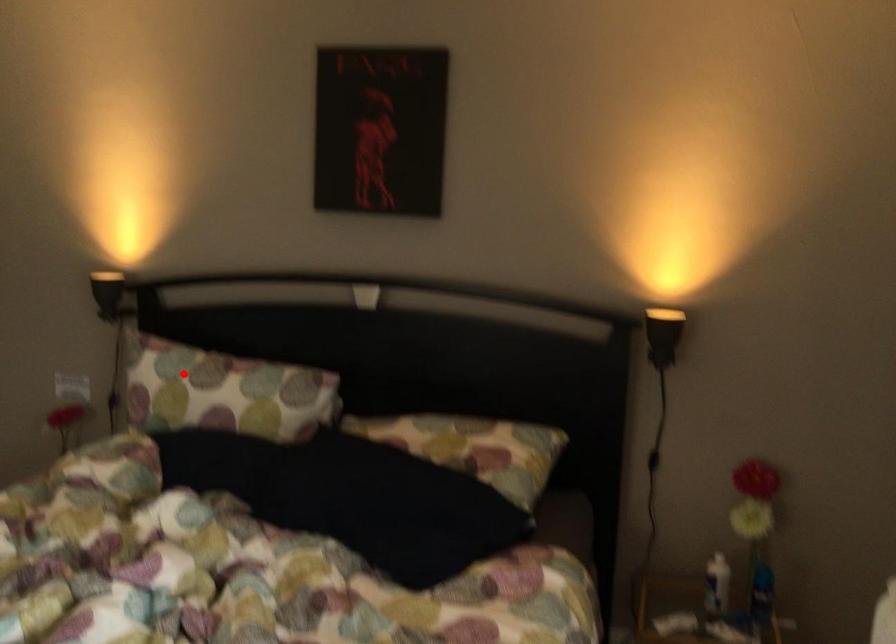
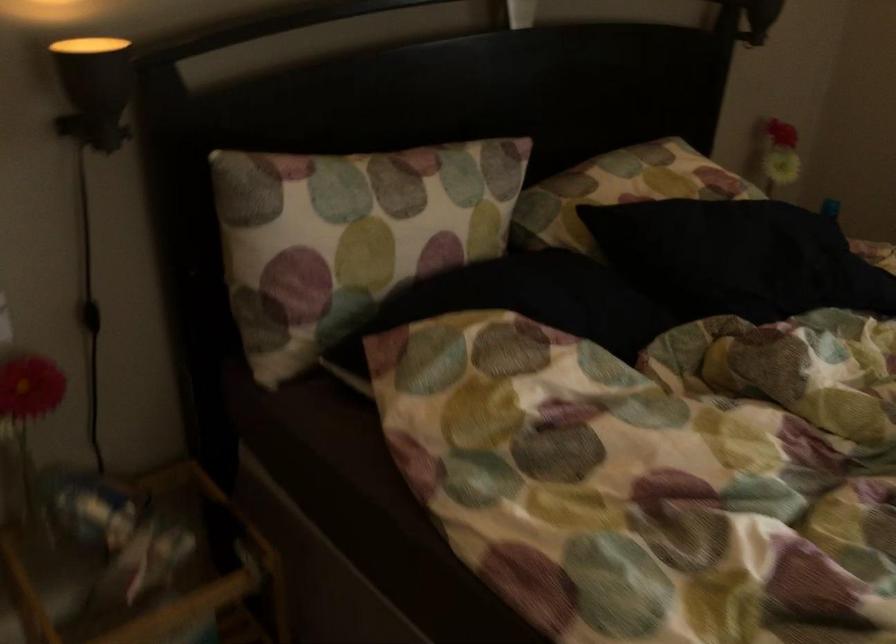
Find the pixel in the second image that matches the highlighted location in the first image.

(367, 207)